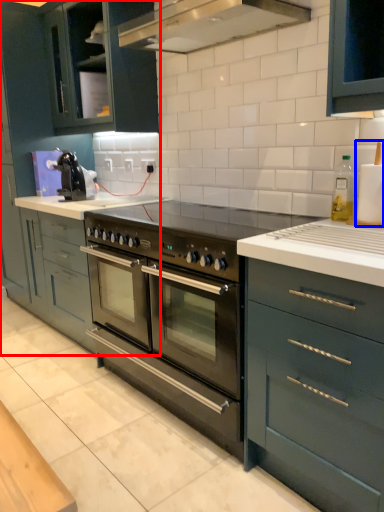
Question: Which of the following is the farthest to the observer, cabinetry (highlighted by a red box) or appliance (highlighted by a blue box)?

Choices:
 (A) cabinetry
 (B) appliance

Answer: (A)